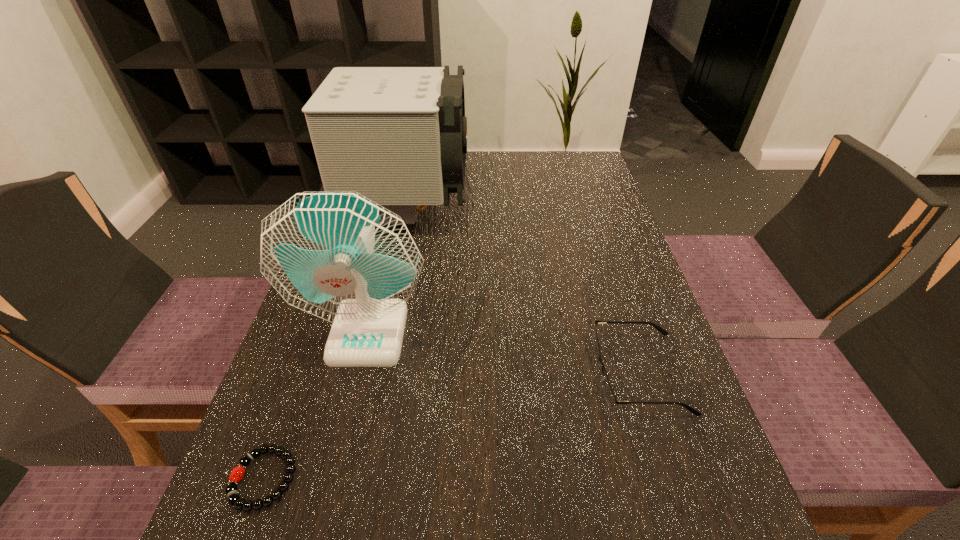
This screenshot has height=540, width=960. Identify the location of the farther fan. (397, 135).

This screenshot has width=960, height=540. What are the coordinates of `the nearer fan` in the screenshot? It's located at (338, 255).

Find the location of a particular element. The width and height of the screenshot is (960, 540). the third tallest object is located at coordinates (610, 397).

At what (x,y) coordinates should I click in order to perform the action: click on the rightmost object. Please return your answer as a coordinate pair (x, y). Looking at the image, I should click on (610, 397).

Where is `the nearest object`? the nearest object is located at coordinates (237, 473).

Where is `bracelet`? bracelet is located at coordinates (237, 473).

The height and width of the screenshot is (540, 960). I want to click on free space located on the front of the farther fan, so click(x=375, y=359).

Identify the location of vacant space located 0.100m in front of the nearer fan to face the airflow. [x=348, y=418].

I want to click on vacant space located 0.080m on the front-facing side of the third tallest object, so click(551, 373).

Locate an element on the screen. The height and width of the screenshot is (540, 960). free space located on the front-facing side of the third tallest object is located at coordinates (374, 373).